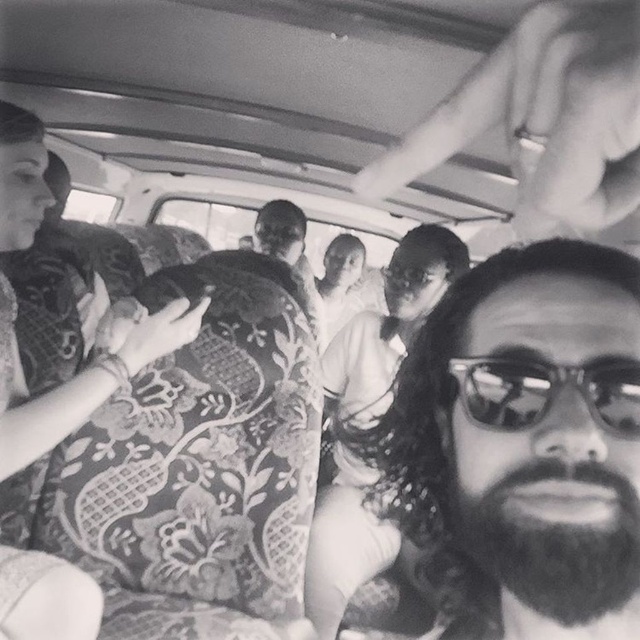
Question: Which object is the closest to the bearded man at center?

Choices:
 (A) dark brown thick beard at lower right
 (B) smooth skin man at center
 (C) sunglasses at center

Answer: (A)

Question: Which of the following is the farthest from the observer?

Choices:
 (A) (561, 611)
 (B) (502, 332)
 (C) (509, 420)

Answer: (B)

Question: Is dark brown thick beard at lower right thinner than sunglasses at center?

Choices:
 (A) yes
 (B) no

Answer: (A)

Question: Is bearded man at center positioned in front of smooth skin man at center?

Choices:
 (A) no
 (B) yes

Answer: (B)

Question: Which of the following is the closest to the observer?

Choices:
 (A) bearded man at center
 (B) dark brown thick beard at lower right
 (C) smooth skin man at center
 (D) sunglasses at center

Answer: (A)

Question: Does sunglasses at center appear under smooth skin man at center?

Choices:
 (A) no
 (B) yes

Answer: (B)